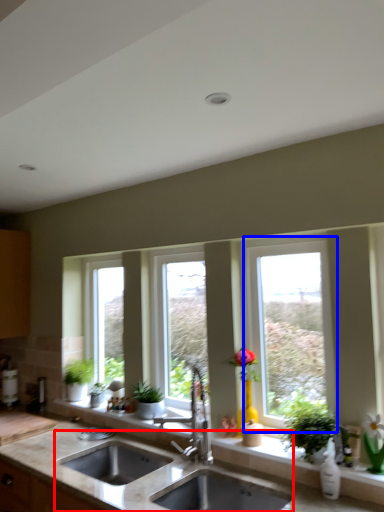
Question: Among these objects, which one is nearest to the camera, sink (highlighted by a red box) or window (highlighted by a blue box)?

Choices:
 (A) sink
 (B) window

Answer: (A)